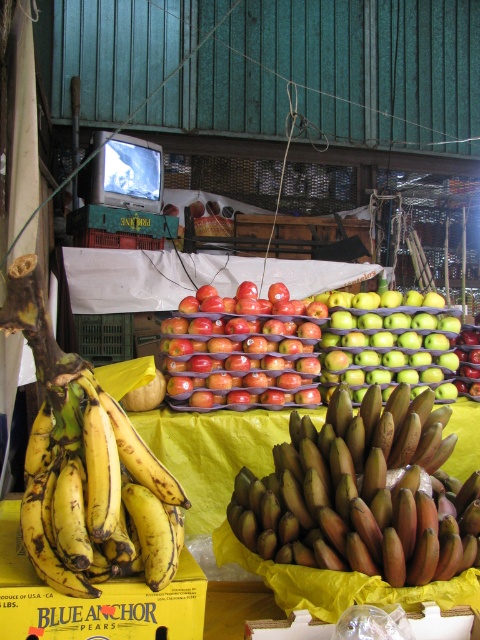
Question: Does shiny red apples at center appear over green matte apples at center?

Choices:
 (A) yes
 (B) no

Answer: (B)

Question: Which object is the closest to the yellow matte bananas at lower left?

Choices:
 (A) brown rough bananas at center
 (B) green matte apples at center
 (C) shiny red apples at center

Answer: (A)

Question: Which object is farther from the camera taking this photo?

Choices:
 (A) green matte apples at center
 (B) yellow matte bananas at lower left

Answer: (A)

Question: Is brown rough bananas at center further to the viewer compared to green matte apples at center?

Choices:
 (A) yes
 (B) no

Answer: (B)

Question: Among these points, which one is farthest from the camera?

Choices:
 (A) (56, 525)
 (B) (423, 372)
 (C) (388, 522)

Answer: (B)

Question: Does yellow matte bananas at lower left appear on the right side of green matte apples at center?

Choices:
 (A) yes
 (B) no

Answer: (B)